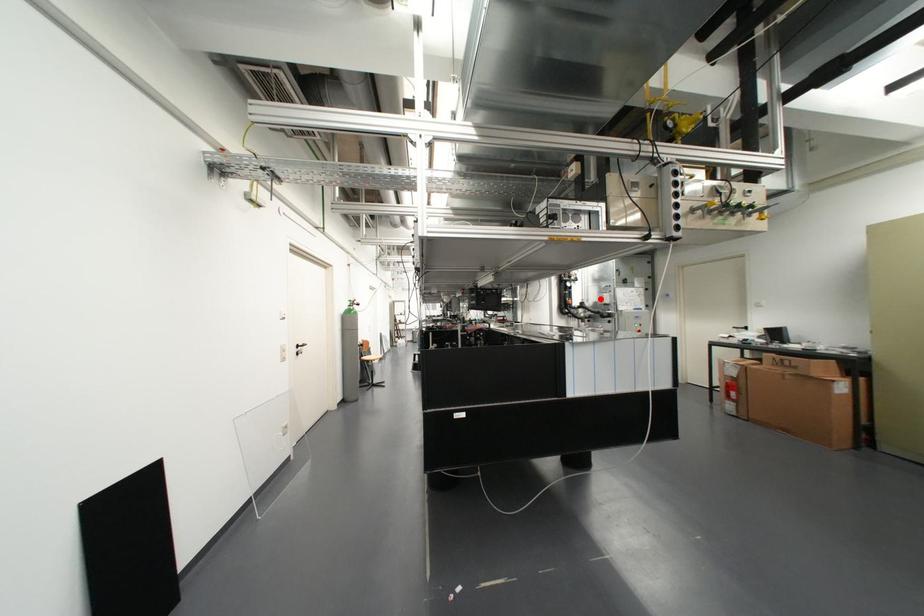
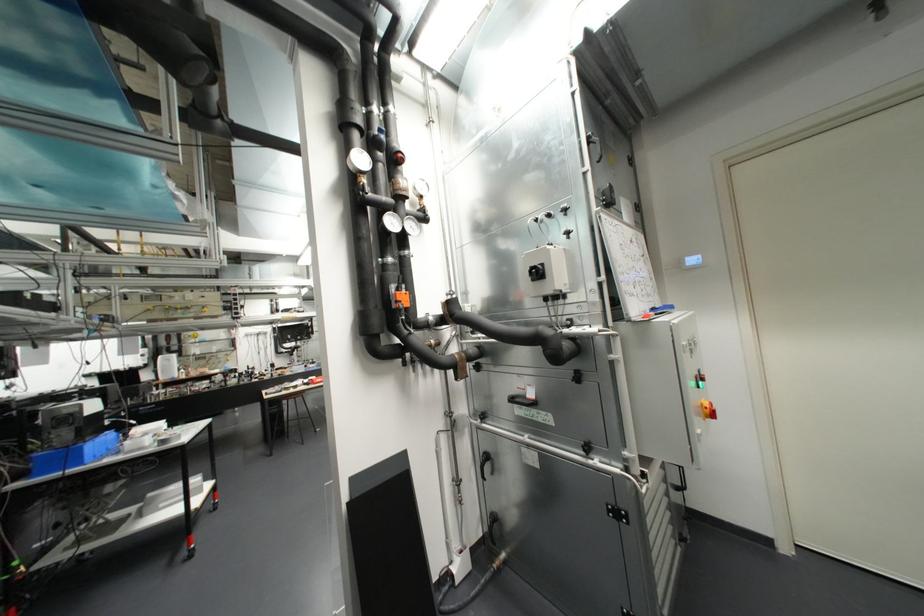
Find the pixel in the second image that matches the highlighted location in the first image.

(537, 273)